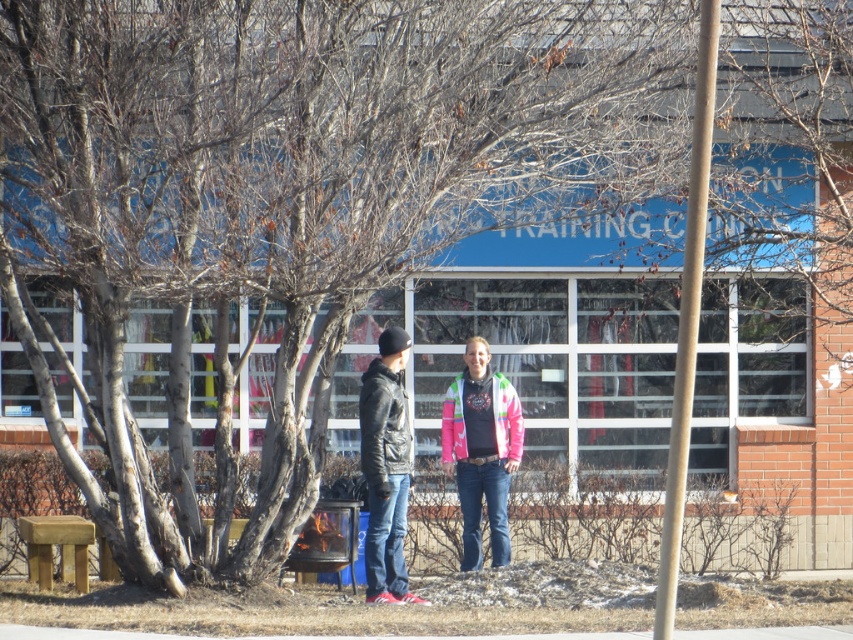
Question: Is the position of pink fleece jacket at center less distant than that of leather jacket at center?

Choices:
 (A) no
 (B) yes

Answer: (A)

Question: Does pink fleece jacket at center appear on the left side of pink/textured jacket at center?

Choices:
 (A) no
 (B) yes

Answer: (B)

Question: Which object is the farthest from the leather jacket at center?

Choices:
 (A) pink fleece jacket at center
 (B) pink/textured jacket at center

Answer: (B)

Question: Does pink/textured jacket at center have a larger size compared to leather jacket at center?

Choices:
 (A) no
 (B) yes

Answer: (B)

Question: Which of the following is the closest to the observer?

Choices:
 (A) (373, 435)
 (B) (462, 493)

Answer: (A)

Question: Which of the following is the farthest from the observer?

Choices:
 (A) pink/textured jacket at center
 (B) leather jacket at center

Answer: (A)